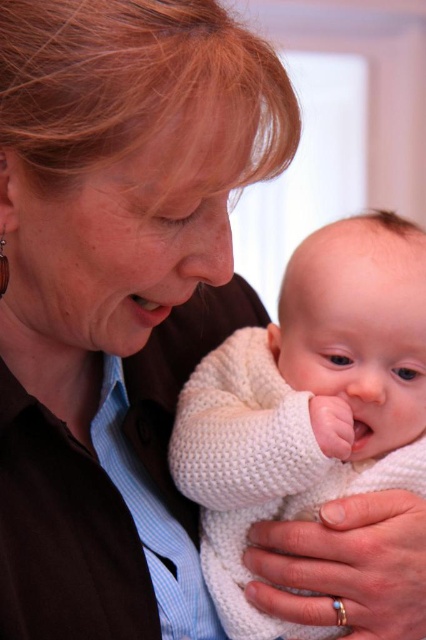
Is matte brown sweater at center shorter than white knitted sweater at center?

No, matte brown sweater at center is not shorter than white knitted sweater at center.

Between matte brown sweater at center and white knitted sweater at center, which one is positioned lower?

Positioned lower is white knitted sweater at center.

Which is in front, point (181, 125) or point (317, 307)?

Point (181, 125) is in front.

Locate an element on the screen. The image size is (426, 640). matte brown sweater at center is located at coordinates (109, 268).